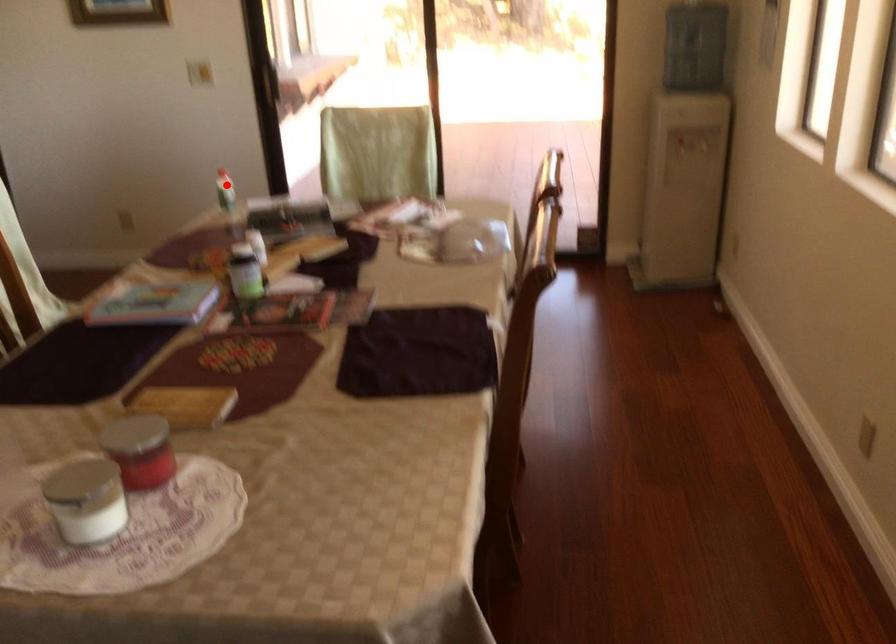
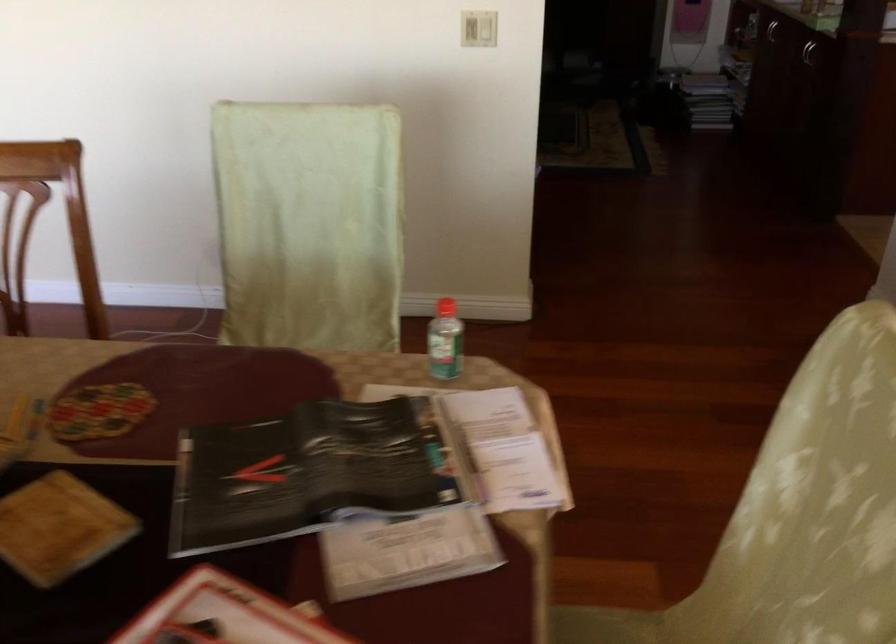
Question: A red point is marked in image1. In image2, is the corresponding 3D point closer to the camera or farther? Reply with the corresponding letter.

Choices:
 (A) The corresponding 3D point is closer.
 (B) The corresponding 3D point is farther.

Answer: (A)